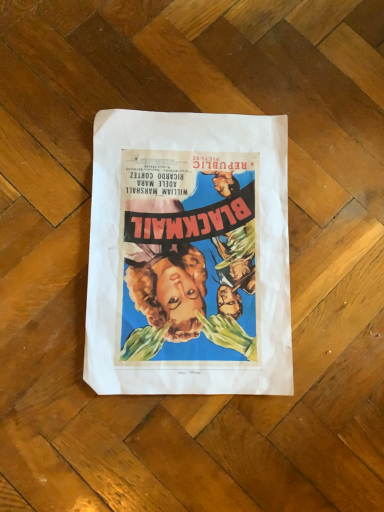
Describe the element at coordinates (189, 255) in the screenshot. This screenshot has height=512, width=384. I see `matte paper poster at center` at that location.

At what (x,y) coordinates should I click in order to perform the action: click on matte paper poster at center. Please return your answer as a coordinate pair (x, y). Looking at the image, I should click on (189, 255).

Identify the location of matte paper poster at center. This screenshot has width=384, height=512. (189, 255).